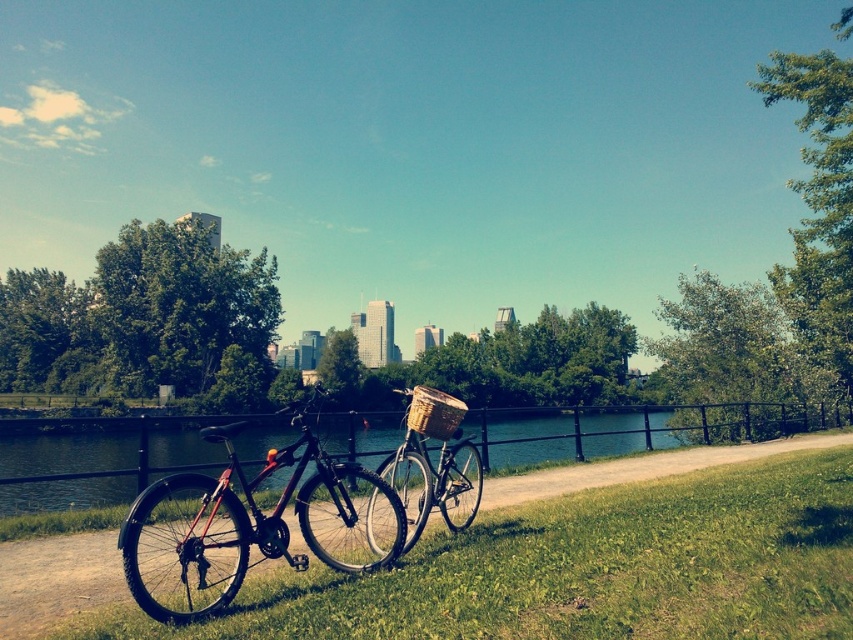
Question: Considering the relative positions of green grass at lower left and green water at lower left in the image provided, where is green grass at lower left located with respect to green water at lower left?

Choices:
 (A) above
 (B) below

Answer: (A)

Question: Which point is closer to the camera taking this photo?

Choices:
 (A) (664, 584)
 (B) (448, 413)
 (C) (192, 532)

Answer: (A)

Question: Is shiny black mountain bike at center above green water at lower left?

Choices:
 (A) yes
 (B) no

Answer: (A)

Question: Can you confirm if shiny black mountain bike at center is positioned below woven brown basket at center?

Choices:
 (A) yes
 (B) no

Answer: (A)

Question: Which of the following is the closest to the observer?

Choices:
 (A) matte brown basket at center
 (B) green water at lower left
 (C) shiny black mountain bike at center

Answer: (C)

Question: Among these objects, which one is nearest to the camera?

Choices:
 (A) green grass at lower left
 (B) shiny black mountain bike at center
 (C) green water at lower left

Answer: (A)